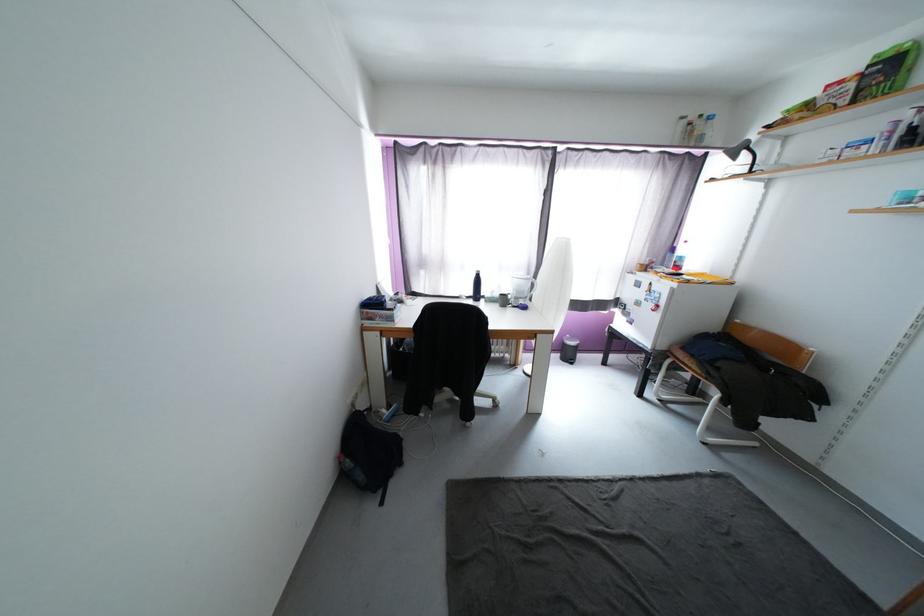
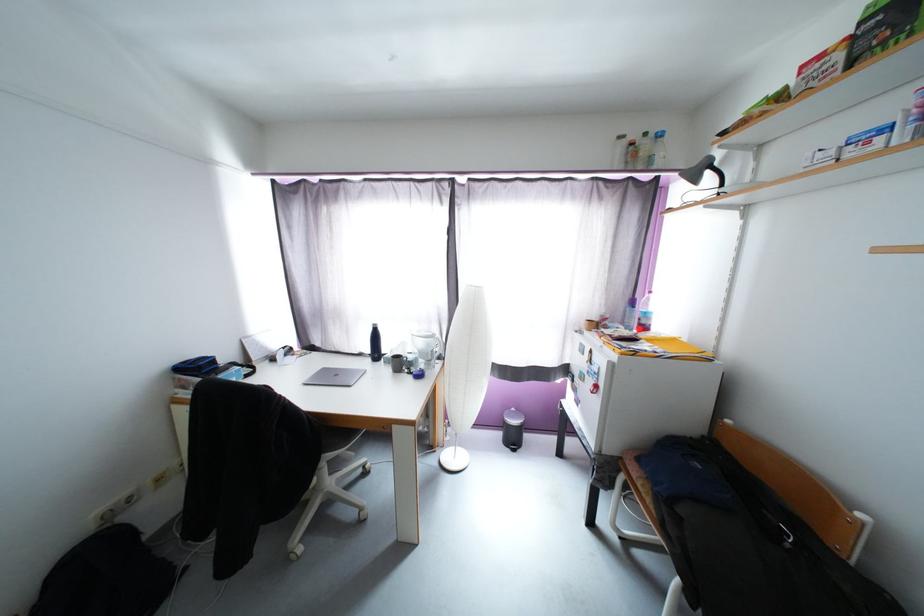
In the second image, find the point that corresponds to pixel 696 126 in the first image.

(638, 146)